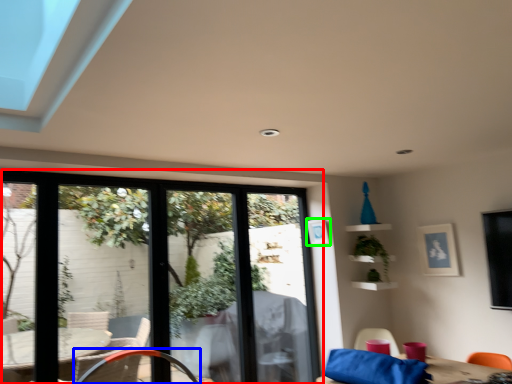
Question: Considering the real-world distances, which object is closest to window (highlighted by a red box)? chair (highlighted by a blue box) or picture frame (highlighted by a green box).

Choices:
 (A) chair
 (B) picture frame

Answer: (A)